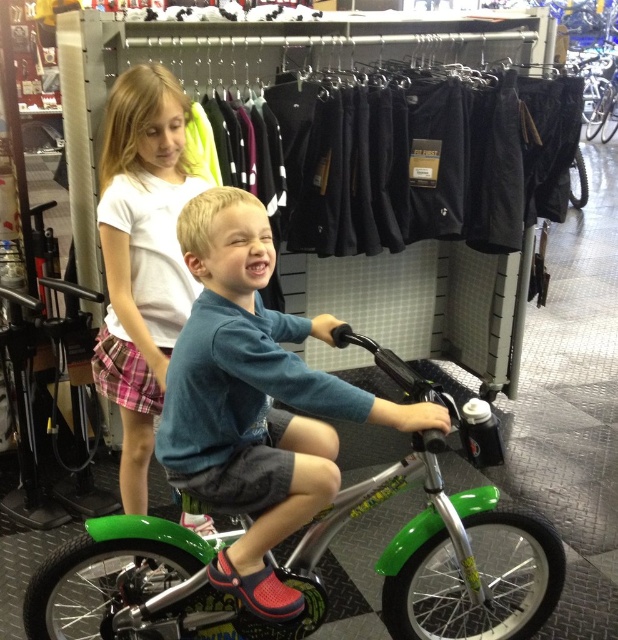
Image resolution: width=618 pixels, height=640 pixels. What do you see at coordinates (255, 401) in the screenshot?
I see `green metallic bicycle at center` at bounding box center [255, 401].

What do you see at coordinates (255, 401) in the screenshot?
I see `green metallic bicycle at center` at bounding box center [255, 401].

Where is `green metallic bicycle at center`? green metallic bicycle at center is located at coordinates (255, 401).

Which is more to the right, green plastic bicycle at center or green metallic bicycle at center?

green plastic bicycle at center is more to the right.

Which is more to the left, green plastic bicycle at center or green metallic bicycle at center?

From the viewer's perspective, green metallic bicycle at center appears more on the left side.

Which is in front, point (465, 490) or point (164, 417)?

Positioned in front is point (164, 417).

At what (x,y) coordinates should I click in order to perform the action: click on green plastic bicycle at center. Please return your answer as a coordinate pair (x, y). Looking at the image, I should click on (305, 572).

Does green plastic bicycle at center appear under white cotton shirt at upper left?

Yes.

Is point (292, 630) behind point (161, 154)?

No, (292, 630) is in front of (161, 154).

Which is behind, point (381, 348) or point (129, 436)?

Point (129, 436)

Image resolution: width=618 pixels, height=640 pixels. Identify the location of green plastic bicycle at center. (305, 572).